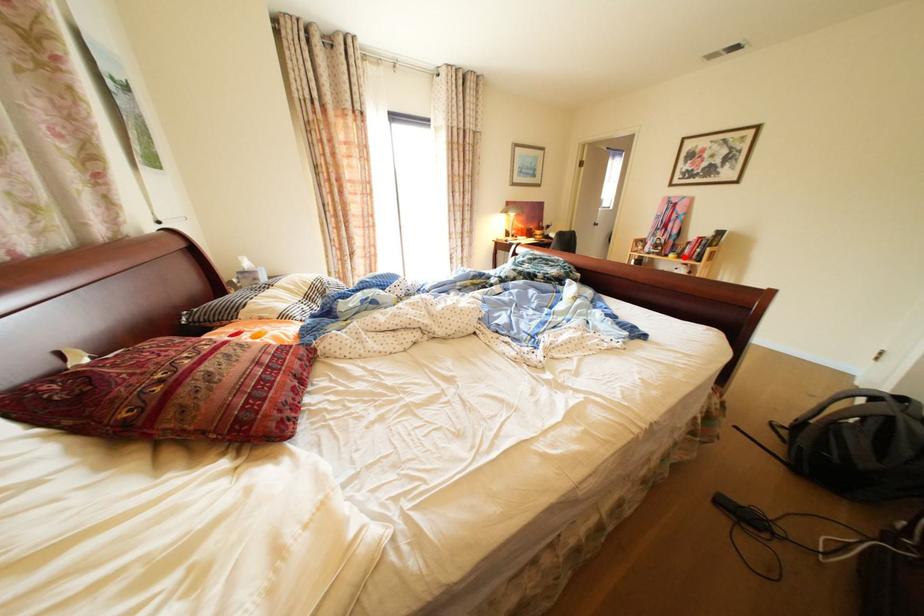
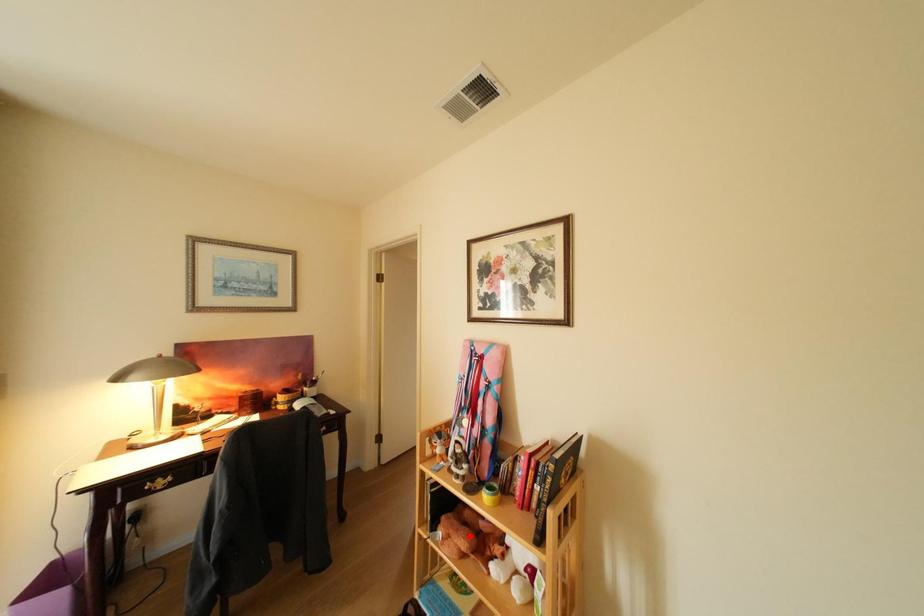
I am providing you with two images of the same scene from different viewpoints. A red point is marked on the first image and another point is marked on the second image. Does the point marked in image1 correspond to the same location as the one in image2?

No